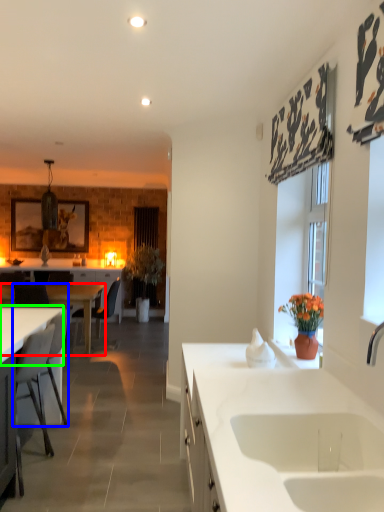
Question: Which object is positioned farthest from desk (highlighted by a red box)? Select from armchair (highlighted by a blue box) and countertop (highlighted by a green box).

Choices:
 (A) armchair
 (B) countertop

Answer: (B)